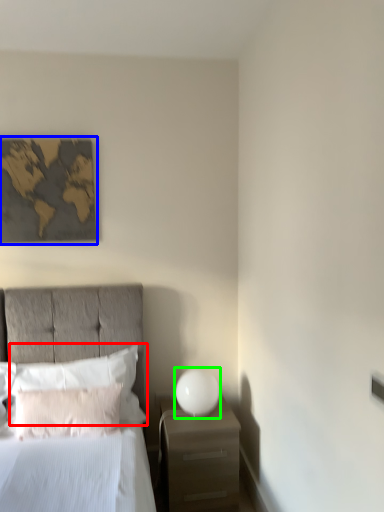
Question: Estimate the real-world distances between objects in this image. Which object is closer to pillow (highlighted by a red box), picture frame (highlighted by a blue box) or bedside lamp (highlighted by a green box)?

Choices:
 (A) picture frame
 (B) bedside lamp

Answer: (B)